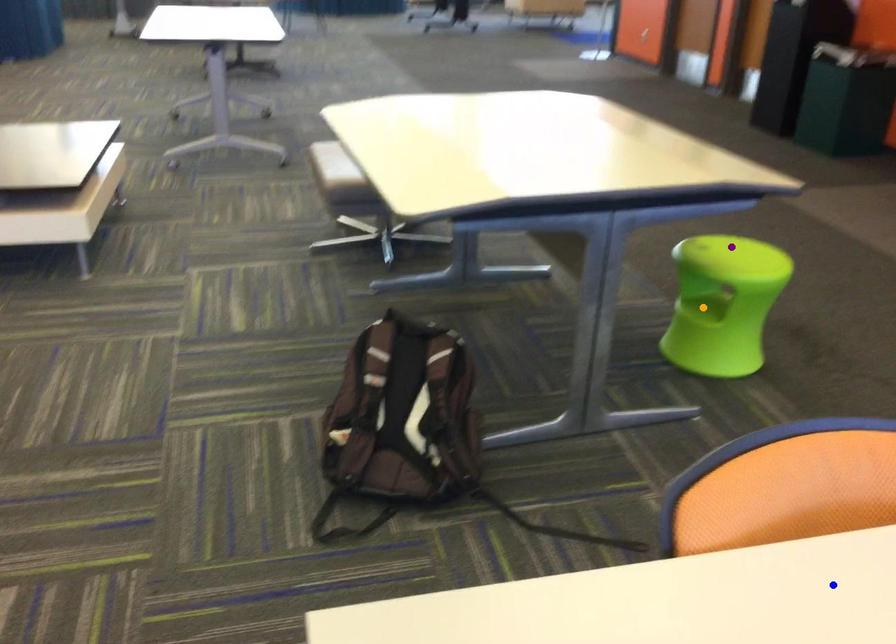
Order these from nearest to farthest:
orange point | purple point | blue point

blue point
purple point
orange point